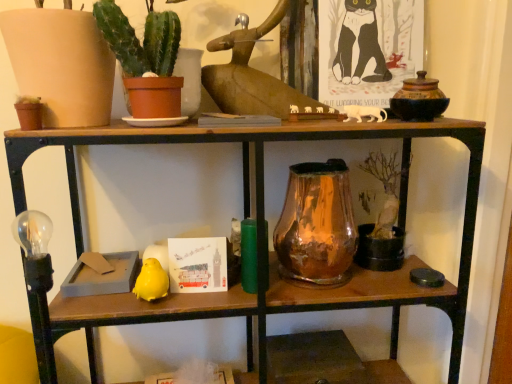
What do you see at coordinates (151, 281) in the screenshot?
I see `yellow matte bird at lower left` at bounding box center [151, 281].

What do you see at coordinates (145, 58) in the screenshot? I see `green matte cactus at upper left` at bounding box center [145, 58].

I want to click on amber glass vase at center, so click(x=316, y=224).

Where is `yellow matte bird at lower left`? yellow matte bird at lower left is located at coordinates (151, 281).

Looking at this image, does yellow matte bird at lower left touch amber glass vase at center?

No, yellow matte bird at lower left is not with amber glass vase at center.

Relative to amber glass vase at center, is yellow matte bird at lower left in front or behind?

yellow matte bird at lower left is positioned closer to the viewer than amber glass vase at center.

How different are the orientations of yellow matte bird at lower left and amber glass vase at center in degrees?

The angle between the facing direction of yellow matte bird at lower left and the facing direction of amber glass vase at center is 2.19 degrees.

Does yellow matte bird at lower left turn towards amber glass vase at center?

No, yellow matte bird at lower left is not oriented towards amber glass vase at center.

Which is behind, green matte cactus at upper left or amber glass vase at center?

amber glass vase at center.

Between green matte cactus at upper left and amber glass vase at center, which one has larger size?

amber glass vase at center is bigger.

Is green matte cactus at upper left facing towards amber glass vase at center?

No, green matte cactus at upper left is not turned towards amber glass vase at center.

The height and width of the screenshot is (384, 512). Find the location of `houseplant on the left of amber glass vase at center`. houseplant on the left of amber glass vase at center is located at coordinates (145, 58).

Is yellow matte bird at lower left bigger than green matte cactus at upper left?

Incorrect, yellow matte bird at lower left is not larger than green matte cactus at upper left.

Could you tell me if yellow matte bird at lower left is facing green matte cactus at upper left?

No, yellow matte bird at lower left is not oriented towards green matte cactus at upper left.

Are yellow matte bird at lower left and green matte cactus at upper left beside each other?

No, yellow matte bird at lower left is not beside green matte cactus at upper left.

Where is `animal on the left of the green matte cactus at upper left`? The image size is (512, 384). animal on the left of the green matte cactus at upper left is located at coordinates (151, 281).

From a real-world perspective, between amber glass vase at center and yellow matte bird at lower left, who is vertically lower?

yellow matte bird at lower left, from a real-world perspective.

Is amber glass vase at center outside of yellow matte bird at lower left?

amber glass vase at center lies outside yellow matte bird at lower left's area.

Based on the photo, between amber glass vase at center and yellow matte bird at lower left, which one appears on the right side from the viewer's perspective?

From the viewer's perspective, amber glass vase at center appears more on the right side.

Which object is wider, green matte cactus at upper left or yellow matte bird at lower left?

With larger width is green matte cactus at upper left.

From a real-world perspective, is green matte cactus at upper left positioned over yellow matte bird at lower left based on gravity?

Yes, from a real-world perspective, green matte cactus at upper left is above yellow matte bird at lower left.

In the image, is green matte cactus at upper left positioned in front of or behind yellow matte bird at lower left?

green matte cactus at upper left is positioned closer to the viewer than yellow matte bird at lower left.

Which of these two, amber glass vase at center or green matte cactus at upper left, stands shorter?

With less height is green matte cactus at upper left.

What's the angular difference between amber glass vase at center and green matte cactus at upper left's facing directions?

2.18 degrees separate the facing orientations of amber glass vase at center and green matte cactus at upper left.

In the scene shown: From the image's perspective, is amber glass vase at center on top of green matte cactus at upper left?

No, from the image's perspective, amber glass vase at center is not on top of green matte cactus at upper left.

Does amber glass vase at center touch green matte cactus at upper left?

amber glass vase at center is not next to green matte cactus at upper left, and they're not touching.

Identify the location of animal on the left of amber glass vase at center. The height and width of the screenshot is (384, 512). (151, 281).

The image size is (512, 384). I want to click on houseplant that is in front of the amber glass vase at center, so click(x=145, y=58).

Based on their spatial positions, is green matte cactus at upper left or yellow matte bird at lower left closer to amber glass vase at center?

yellow matte bird at lower left lies closer to amber glass vase at center than the other object.

When comparing their distances from amber glass vase at center, does yellow matte bird at lower left or green matte cactus at upper left seem further?

Based on the image, green matte cactus at upper left appears to be further to amber glass vase at center.

Looking at the image, which one is located closer to green matte cactus at upper left, yellow matte bird at lower left or amber glass vase at center?

The object closer to green matte cactus at upper left is amber glass vase at center.

Based on their spatial positions, is amber glass vase at center or yellow matte bird at lower left closer to green matte cactus at upper left?

amber glass vase at center.

Which object lies nearer to the anchor point yellow matte bird at lower left, amber glass vase at center or green matte cactus at upper left?

amber glass vase at center.

Estimate the real-world distances between objects in this image. Which object is closer to yellow matte bird at lower left, green matte cactus at upper left or amber glass vase at center?

Among the two, amber glass vase at center is located nearer to yellow matte bird at lower left.

Find the location of a particular element. The image size is (512, 384). glass vase between green matte cactus at upper left and yellow matte bird at lower left in the vertical direction is located at coordinates (316, 224).